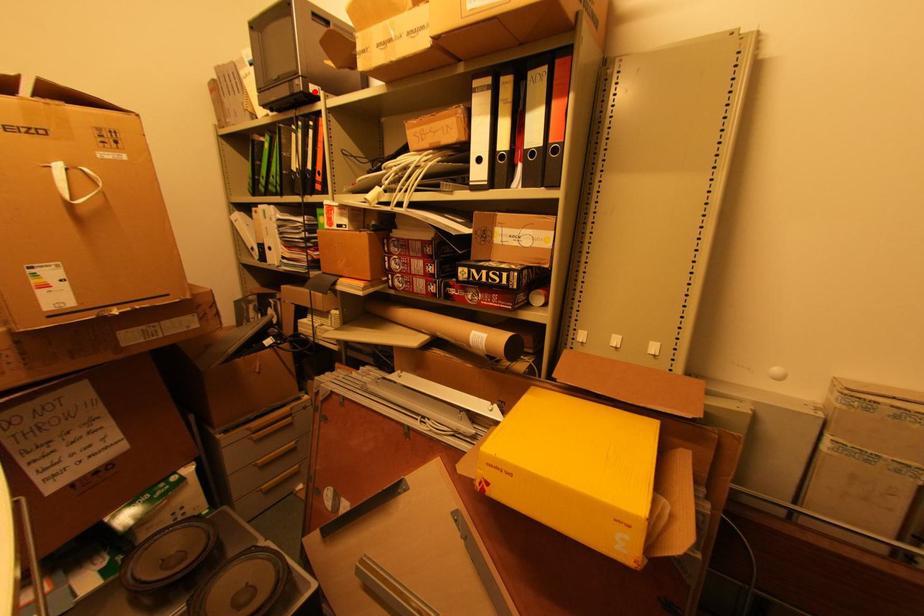
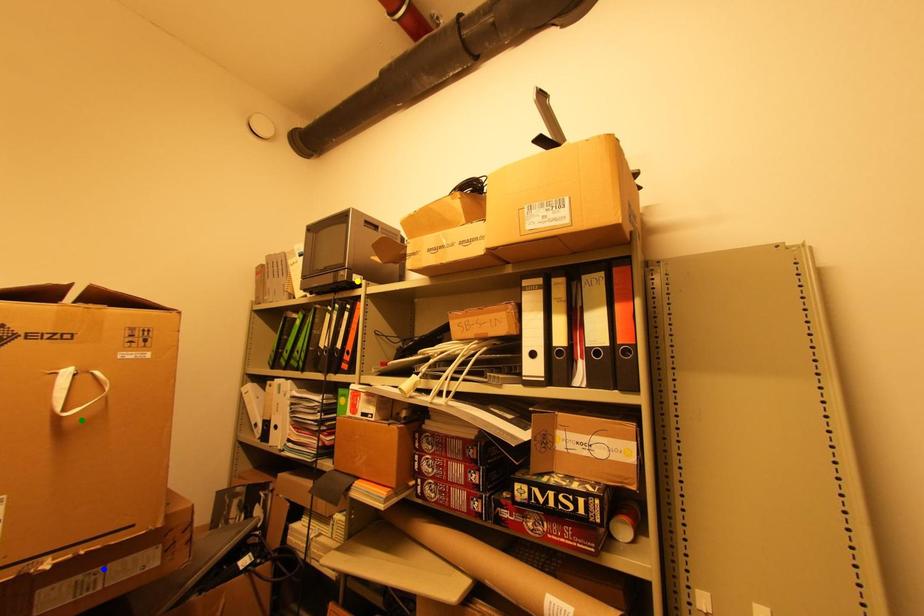
Question: I am providing you with two images of the same scene from different viewpoints. A red point is marked on the first image. You are given multiple points on the second image. Can you choose the point in image 2 that corresponds to the point in image 1?

Choices:
 (A) yellow point
 (B) green point
 (C) blue point

Answer: (A)